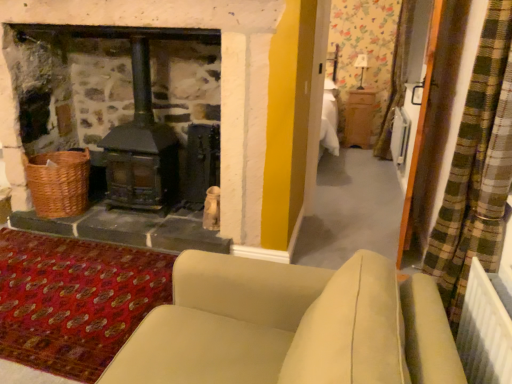
Question: Is black matte wood burning stove at left with beige fabric couch at lower center?

Choices:
 (A) yes
 (B) no

Answer: (B)

Question: Is black matte wood burning stove at left taller than beige fabric couch at lower center?

Choices:
 (A) yes
 (B) no

Answer: (A)

Question: Is black matte wood burning stove at left facing away from beige fabric couch at lower center?

Choices:
 (A) yes
 (B) no

Answer: (B)

Question: Is black matte wood burning stove at left far from beige fabric couch at lower center?

Choices:
 (A) yes
 (B) no

Answer: (A)

Question: From a real-world perspective, does black matte wood burning stove at left sit lower than beige fabric couch at lower center?

Choices:
 (A) yes
 (B) no

Answer: (B)

Question: Does black matte wood burning stove at left appear on the right side of beige fabric couch at lower center?

Choices:
 (A) no
 (B) yes

Answer: (A)

Question: From a real-world perspective, is woven brown basket at lower left on top of beige fabric couch at lower center?

Choices:
 (A) no
 (B) yes

Answer: (A)

Question: Is woven brown basket at lower left to the right of beige fabric couch at lower center from the viewer's perspective?

Choices:
 (A) yes
 (B) no

Answer: (B)

Question: Is woven brown basket at lower left far from beige fabric couch at lower center?

Choices:
 (A) yes
 (B) no

Answer: (A)

Question: Is woven brown basket at lower left positioned before beige fabric couch at lower center?

Choices:
 (A) no
 (B) yes

Answer: (A)

Question: Can you confirm if woven brown basket at lower left is smaller than beige fabric couch at lower center?

Choices:
 (A) yes
 (B) no

Answer: (A)

Question: From the image's perspective, does woven brown basket at lower left appear lower than beige fabric couch at lower center?

Choices:
 (A) no
 (B) yes

Answer: (A)

Question: Does black matte wood burning stove at left have a larger size compared to white plastic screen door at right?

Choices:
 (A) no
 (B) yes

Answer: (B)